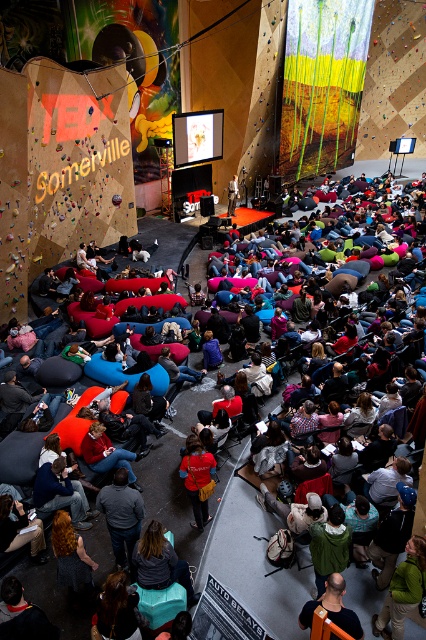
Between dark blue fabric seat at center and matte black laptop at center, which one is positioned higher?

matte black laptop at center is above.

Identify the location of dark blue fabric seat at center. (221, 529).

I want to click on dark blue fabric seat at center, so click(x=221, y=529).

Between red matte shirt at center and dark brown leather jacket at lower center, which one has less height?

dark brown leather jacket at lower center is shorter.

Which is in front, point (199, 467) or point (356, 637)?

Point (356, 637)

Who is more distant from viewer, (207, 509) or (331, 605)?

Positioned behind is point (207, 509).

Find the location of a particular element. red matte shirt at center is located at coordinates (198, 477).

Is dark brown leather jacket at lower center smaller than matte black laptop at center?

A: Yes, dark brown leather jacket at lower center is smaller than matte black laptop at center.

Who is lower down, dark brown leather jacket at lower center or matte black laptop at center?

dark brown leather jacket at lower center is lower down.

Which is in front, point (333, 580) or point (233, 205)?

Point (333, 580) is more forward.

Where is `dark brown leather jacket at lower center`? The width and height of the screenshot is (426, 640). dark brown leather jacket at lower center is located at coordinates (333, 608).